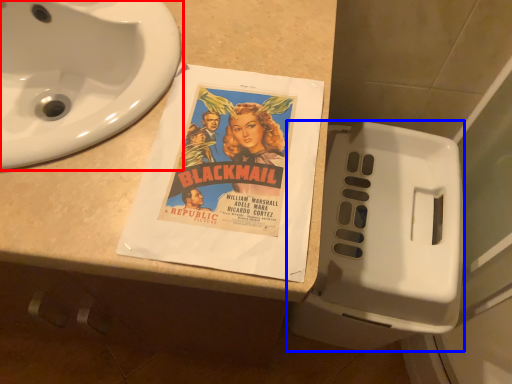
Question: Which point is closer to the camera, sink (highlighted by a red box) or toilet (highlighted by a blue box)?

Choices:
 (A) sink
 (B) toilet

Answer: (A)